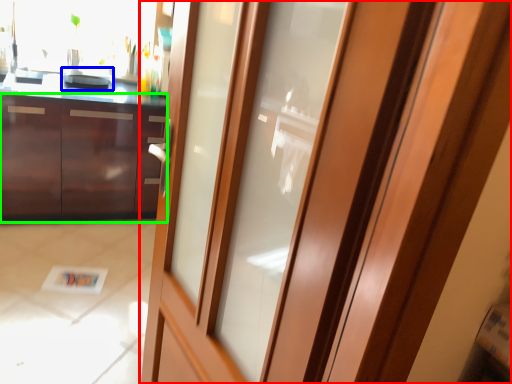
Question: Which object is the closest to the door (highlighted by a red box)? Choose among these: appliance (highlighted by a blue box) or cabinetry (highlighted by a green box).

Choices:
 (A) appliance
 (B) cabinetry

Answer: (B)